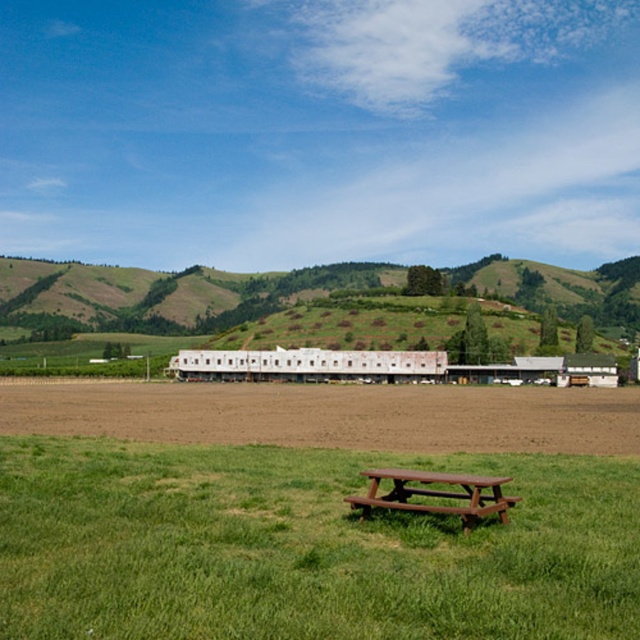
Question: Which of the following is the farthest from the observer?

Choices:
 (A) brown wooden bench at lower center
 (B) brown soil at center

Answer: (B)

Question: Is brown soil at center behind brown wooden bench at lower center?

Choices:
 (A) no
 (B) yes

Answer: (B)

Question: Is green grassy field at center positioned in front of brown soil at center?

Choices:
 (A) no
 (B) yes

Answer: (B)

Question: Is brown soil at center bigger than brown wooden bench at lower center?

Choices:
 (A) yes
 (B) no

Answer: (A)

Question: Which object is the closest to the green grassy field at center?

Choices:
 (A) brown soil at center
 (B) brown wooden bench at lower center

Answer: (B)

Question: Which of these objects is positioned farthest from the green grassy field at center?

Choices:
 (A) brown soil at center
 (B) brown wooden bench at lower center

Answer: (A)